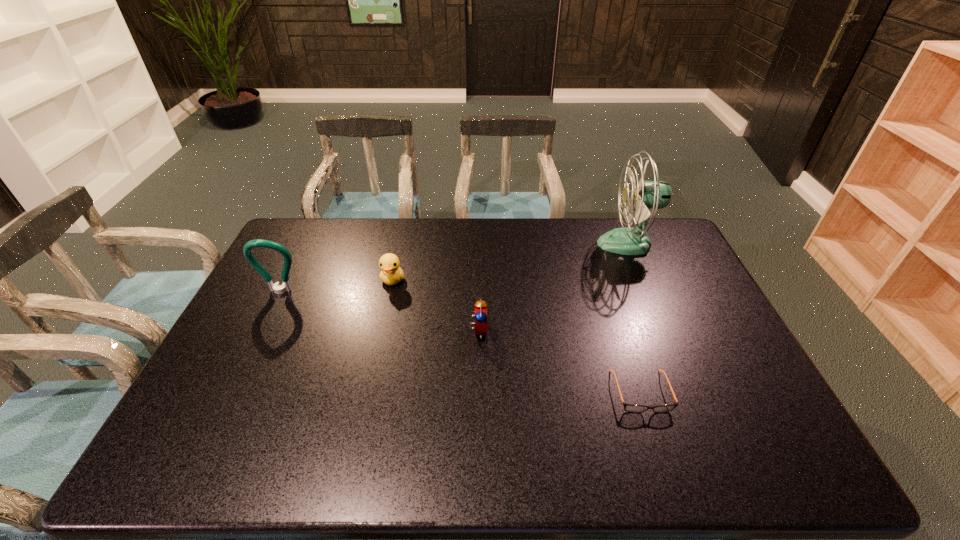
Find the location of a particular element. The height and width of the screenshot is (540, 960). vacant space located 0.130m in front of the fan, directing airflow is located at coordinates click(x=563, y=244).

Find the location of a particular element. vacant space positioned in front of the fan, directing airflow is located at coordinates (521, 244).

This screenshot has height=540, width=960. What are the coordinates of `vacant space situated 0.270m at the jaws of the second tallest object` in the screenshot? It's located at (244, 366).

Where is `vacant space located on the front-facing side of the third object from right to left`? This screenshot has height=540, width=960. vacant space located on the front-facing side of the third object from right to left is located at coordinates (511, 330).

Where is `vacant space located 0.260m on the face of the duck`? vacant space located 0.260m on the face of the duck is located at coordinates (376, 353).

You are a GUI agent. You are given a task and a screenshot of the screen. Output one action in this format:
    pyautogui.click(x=<x>, y=<y>)
    Task: Click on the vacant space located 0.140m on the front-facing side of the nearest object
    
    Given the screenshot: What is the action you would take?
    pyautogui.click(x=666, y=471)

Where is `object present at the far edge`? object present at the far edge is located at coordinates (647, 195).

You are a GUI agent. You are given a task and a screenshot of the screen. Output one action in this format:
    pyautogui.click(x=<x>, y=<y>)
    Task: Click on the object present at the left edge
    
    Given the screenshot: What is the action you would take?
    pyautogui.click(x=277, y=288)

You are a GUI agent. You are given a task and a screenshot of the screen. Output one action in this format:
    pyautogui.click(x=<x>, y=<y>)
    Task: Click on the object positioned at the right edge
    The width and height of the screenshot is (960, 540).
    Given the screenshot: What is the action you would take?
    click(x=647, y=195)

Find the location of a particular element. This screenshot has width=960, height=540. object at the far right corner is located at coordinates (647, 195).